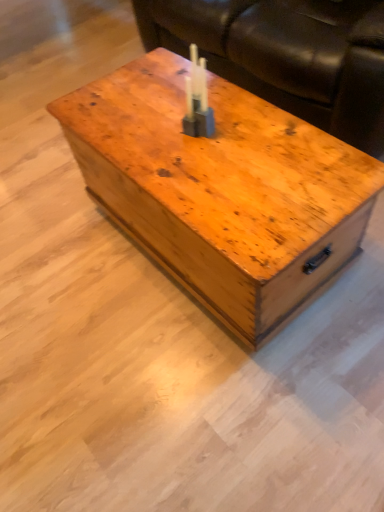
The width and height of the screenshot is (384, 512). I want to click on free space behind translucent plastic candle at center, so click(x=181, y=101).